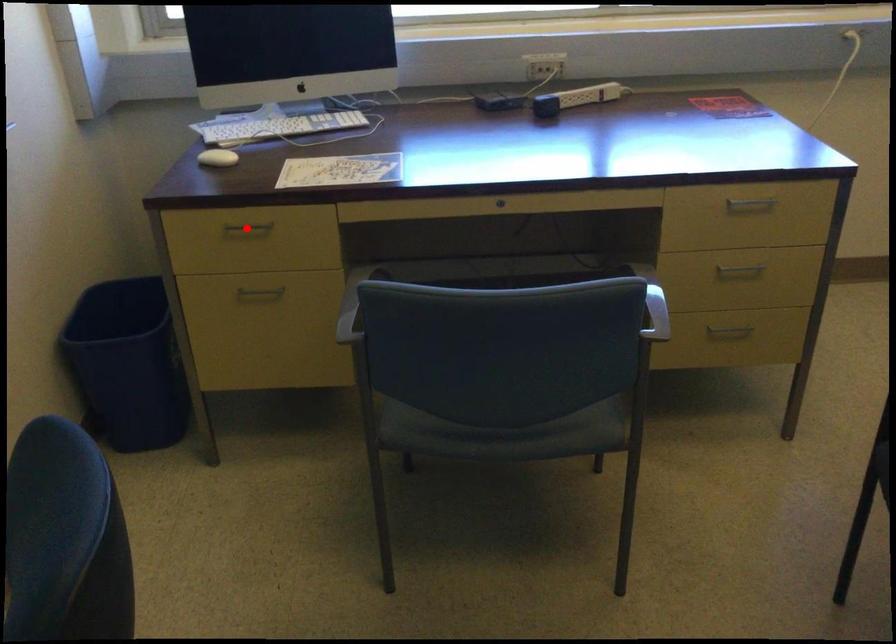
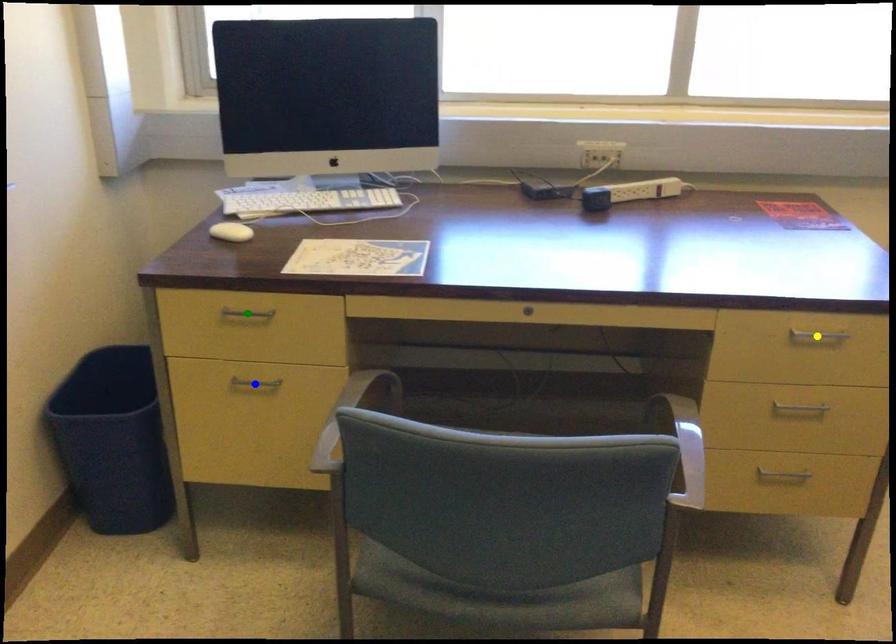
Question: I am providing you with two images of the same scene from different viewpoints. A red point is marked on the first image. You are given multiple points on the second image. Which spot in image 2 lines up with the point in image 1?

Choices:
 (A) yellow point
 (B) blue point
 (C) green point

Answer: (C)